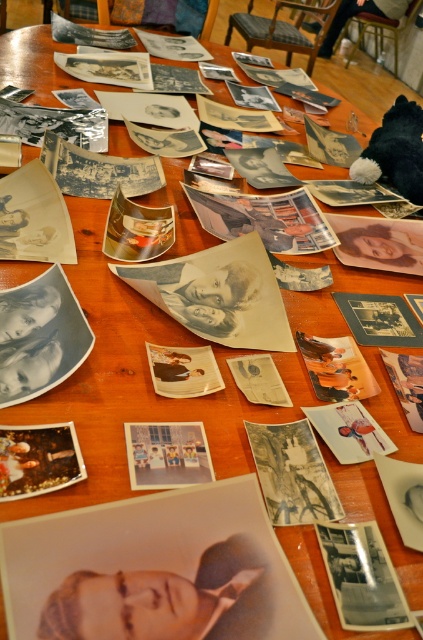
Can you confirm if matte paper portrait at center is taller than matte paper photo at center?

In fact, matte paper portrait at center may be shorter than matte paper photo at center.

What do you see at coordinates (153, 570) in the screenshot?
I see `matte paper portrait at center` at bounding box center [153, 570].

At what (x,y) coordinates should I click in order to perform the action: click on matte paper portrait at center. Please return your answer as a coordinate pair (x, y). Looking at the image, I should click on (153, 570).